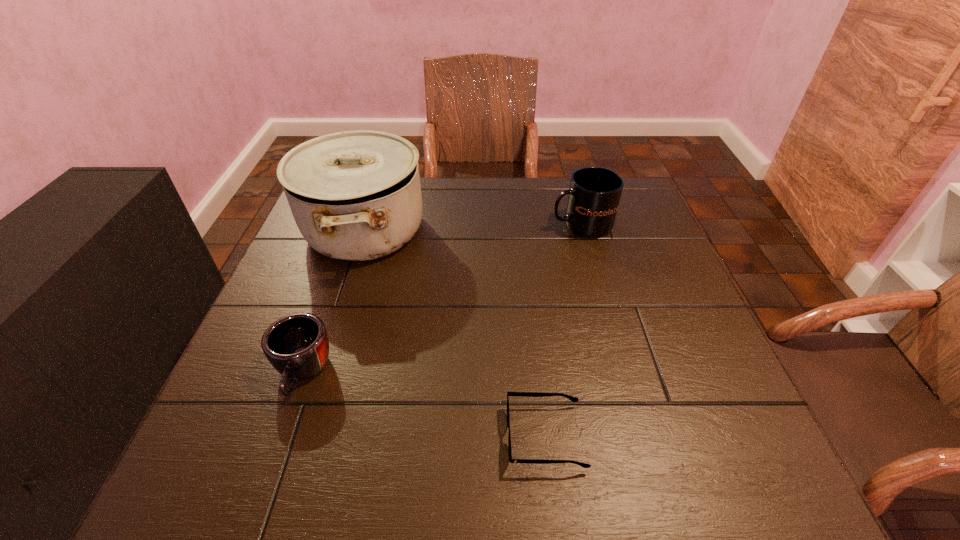
Where is `vacant space that satisfies the following two spatial constraints: 1. with the handle on the side of the taller mug; 2. on the side of the second shortest object with the handle`? The height and width of the screenshot is (540, 960). vacant space that satisfies the following two spatial constraints: 1. with the handle on the side of the taller mug; 2. on the side of the second shortest object with the handle is located at coordinates (622, 373).